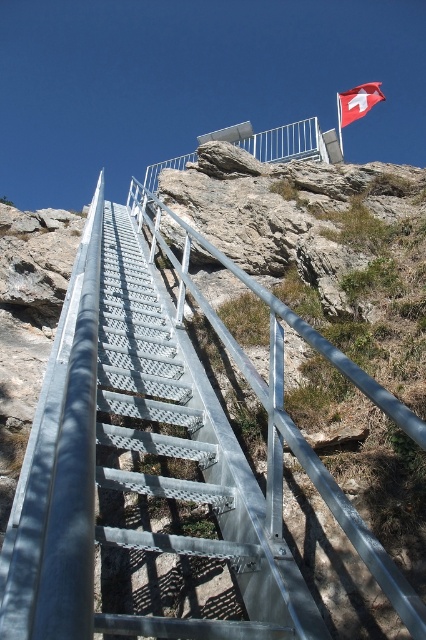
Can you confirm if metallic silver rail at upper center is taller than red fabric flag at upper right?

Incorrect, metallic silver rail at upper center's height is not larger of red fabric flag at upper right's.

Is point (100, 333) less distant than point (362, 106)?

That is True.

Identify the location of metallic silver rail at upper center. The image size is (426, 640). (166, 449).